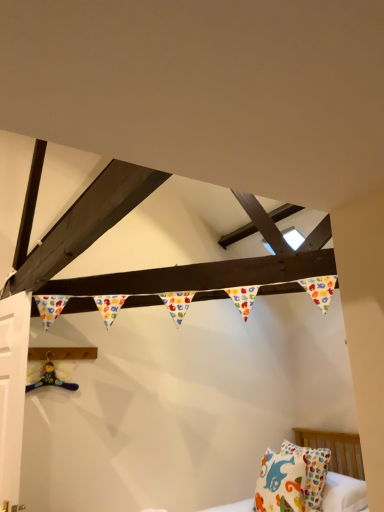
Find the location of `white matte door at left`. white matte door at left is located at coordinates (12, 390).

Describe the element at coordinates (12, 390) in the screenshot. The image size is (384, 512). I see `white matte door at left` at that location.

What do you see at coordinates (292, 479) in the screenshot? I see `white cotton pillow with colorful patterns at lower right` at bounding box center [292, 479].

Identify the location of white matte door at left. 12,390.

Considering the sizes of objects white matte door at left and multicolored plush toy at lower left in the image provided, who is thinner, white matte door at left or multicolored plush toy at lower left?

multicolored plush toy at lower left.

Is white matte door at left oriented towards multicolored plush toy at lower left?

No.

Consider the image. Is white matte door at left not close to multicolored plush toy at lower left?

No, white matte door at left is in close proximity to multicolored plush toy at lower left.

Which of these two, white matte door at left or multicolored plush toy at lower left, is smaller?

With smaller size is multicolored plush toy at lower left.

Consider the image. Is there a large distance between white cotton pillow with colorful patterns at lower right and multicolored plush toy at lower left?

white cotton pillow with colorful patterns at lower right is positioned a significant distance from multicolored plush toy at lower left.

Which of these two, white cotton pillow with colorful patterns at lower right or multicolored plush toy at lower left, is wider?

With larger width is white cotton pillow with colorful patterns at lower right.

In the image, is white cotton pillow with colorful patterns at lower right positioned in front of or behind multicolored plush toy at lower left?

white cotton pillow with colorful patterns at lower right is positioned closer to the viewer than multicolored plush toy at lower left.

The width and height of the screenshot is (384, 512). In order to click on pillow below the multicolored plush toy at lower left (from a real-world perspective) in this screenshot , I will do `click(292, 479)`.

Which is more distant, (40, 381) or (17, 493)?

The point (40, 381) is farther.

Does multicolored plush toy at lower left come behind white matte door at left?

That is True.

In the image, is multicolored plush toy at lower left on the left side or the right side of white matte door at left?

Clearly, multicolored plush toy at lower left is on the right of white matte door at left in the image.

From a real-world perspective, is multicolored plush toy at lower left physically located above or below white cotton pillow with colorful patterns at lower right?

Clearly, from a real-world perspective, multicolored plush toy at lower left is above white cotton pillow with colorful patterns at lower right.

Is white cotton pillow with colorful patterns at lower right inside multicolored plush toy at lower left?

No, white cotton pillow with colorful patterns at lower right is not inside multicolored plush toy at lower left.

Is multicolored plush toy at lower left looking in the opposite direction of white cotton pillow with colorful patterns at lower right?

No, multicolored plush toy at lower left is not facing away from white cotton pillow with colorful patterns at lower right.

Consider the image. Can you confirm if multicolored plush toy at lower left is bigger than white cotton pillow with colorful patterns at lower right?

No.

Who is bigger, white matte door at left or white cotton pillow with colorful patterns at lower right?

white cotton pillow with colorful patterns at lower right.

Does white matte door at left have a lesser height compared to white cotton pillow with colorful patterns at lower right?

In fact, white matte door at left may be taller than white cotton pillow with colorful patterns at lower right.

Is white matte door at left touching white cotton pillow with colorful patterns at lower right?

No.

Based on the photo, does white matte door at left contain white cotton pillow with colorful patterns at lower right?

No, white cotton pillow with colorful patterns at lower right is not surrounded by white matte door at left.

From a real-world perspective, which object rests below the other?

white cotton pillow with colorful patterns at lower right.

From the image's perspective, which object appears higher, white cotton pillow with colorful patterns at lower right or white matte door at left?

white matte door at left appears higher in the image.

Identify the location of door lying on the left of white cotton pillow with colorful patterns at lower right. (12, 390).

The width and height of the screenshot is (384, 512). Identify the location of door that is above the multicolored plush toy at lower left (from the image's perspective). (12, 390).

This screenshot has width=384, height=512. Find the location of `pillow below the multicolored plush toy at lower left (from a real-world perspective)`. pillow below the multicolored plush toy at lower left (from a real-world perspective) is located at coordinates (292, 479).

Which object lies further to the anchor point multicolored plush toy at lower left, white matte door at left or white cotton pillow with colorful patterns at lower right?

Based on the image, white cotton pillow with colorful patterns at lower right appears to be further to multicolored plush toy at lower left.

When comparing their distances from white cotton pillow with colorful patterns at lower right, does white matte door at left or multicolored plush toy at lower left seem further?

The object further to white cotton pillow with colorful patterns at lower right is white matte door at left.

Based on the photo, considering their positions, is white cotton pillow with colorful patterns at lower right positioned closer to white matte door at left than multicolored plush toy at lower left?

Based on the image, multicolored plush toy at lower left appears to be nearer to white matte door at left.

Based on their spatial positions, is multicolored plush toy at lower left or white cotton pillow with colorful patterns at lower right further from white matte door at left?

The object further to white matte door at left is white cotton pillow with colorful patterns at lower right.

Based on their spatial positions, is multicolored plush toy at lower left or white matte door at left further from white cotton pillow with colorful patterns at lower right?

Based on the image, white matte door at left appears to be further to white cotton pillow with colorful patterns at lower right.

Based on their spatial positions, is white cotton pillow with colorful patterns at lower right or white matte door at left closer to multicolored plush toy at lower left?

The object closer to multicolored plush toy at lower left is white matte door at left.

The width and height of the screenshot is (384, 512). What are the coordinates of `toy located between white matte door at left and white cotton pillow with colorful patterns at lower right in the left-right direction` in the screenshot? It's located at (51, 378).